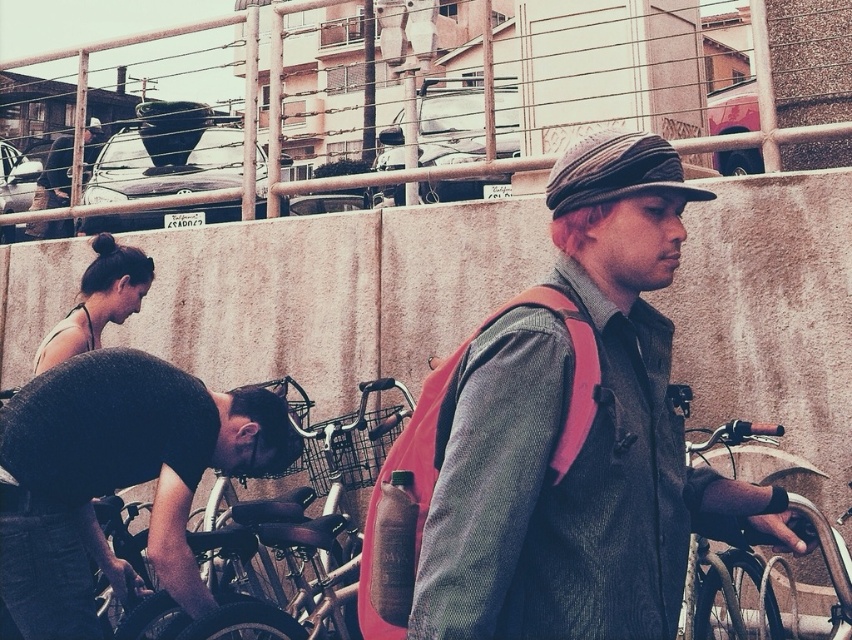
Question: Which point appears farthest from the camera in this image?

Choices:
 (A) (89, 269)
 (B) (95, 141)

Answer: (B)

Question: Estimate the real-world distances between objects in this image. Which object is farther from the matte black hair at upper left?

Choices:
 (A) matte pink backpack at center
 (B) black matte bicycle at lower left

Answer: (A)

Question: Which point is farther from the camera taking this photo?

Choices:
 (A) (611, 566)
 (B) (101, 131)
 (C) (53, 342)
 (D) (117, 412)

Answer: (B)

Question: Does matte pink backpack at center have a larger size compared to matte black hair at upper left?

Choices:
 (A) yes
 (B) no

Answer: (A)

Question: Observing the image, what is the correct spatial positioning of matte pink backpack at center in reference to matte black backpack at upper left?

Choices:
 (A) left
 (B) right

Answer: (B)

Question: Can you confirm if black matte bicycle at lower left is positioned above matte black hair at upper left?

Choices:
 (A) no
 (B) yes

Answer: (A)